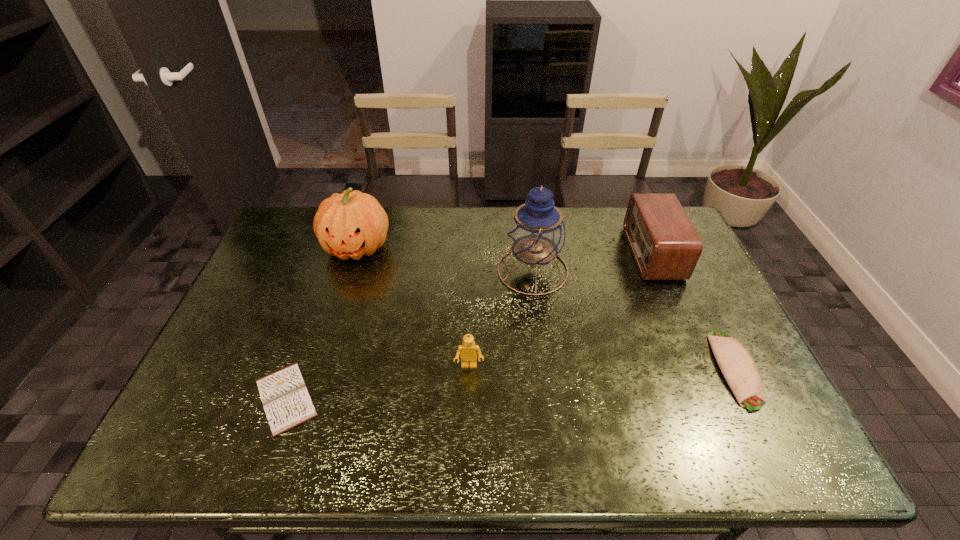
The height and width of the screenshot is (540, 960). What are the coordinates of `free space at the right edge` in the screenshot? It's located at (705, 389).

Where is `vacant space in between the tallest object and the fifth shortest object`? vacant space in between the tallest object and the fifth shortest object is located at coordinates (444, 259).

Locate an element on the screen. Image resolution: width=960 pixels, height=540 pixels. vacant space that's between the fourth shortest object and the third shortest object is located at coordinates (561, 309).

You are a GUI agent. You are given a task and a screenshot of the screen. Output one action in this format:
    pyautogui.click(x=<x>, y=<y>)
    Task: Click on the vacant point located between the radio receiver and the fifth tallest object
    The image size is (960, 540).
    Given the screenshot: What is the action you would take?
    pyautogui.click(x=694, y=311)

Where is `vacant space that is in between the third tallest object and the second tallest object`? Image resolution: width=960 pixels, height=540 pixels. vacant space that is in between the third tallest object and the second tallest object is located at coordinates (505, 251).

You are a GUI agent. You are given a task and a screenshot of the screen. Output one action in this format:
    pyautogui.click(x=<x>, y=<y>)
    Task: Click on the vacant space that is in between the pumpkin and the third shortest object
    
    Given the screenshot: What is the action you would take?
    pyautogui.click(x=413, y=307)

Locate an element on the screen. free space between the third tallest object and the diary is located at coordinates (469, 326).

Identify the location of unoccupied position between the fifth shortest object and the second shortest object. Image resolution: width=960 pixels, height=540 pixels. (546, 308).

Locate an element on the screen. This screenshot has width=960, height=540. empty space between the lantern and the diary is located at coordinates tap(409, 334).

Locate an element on the screen. The width and height of the screenshot is (960, 540). vacant point located between the lantern and the third shortest object is located at coordinates (501, 318).